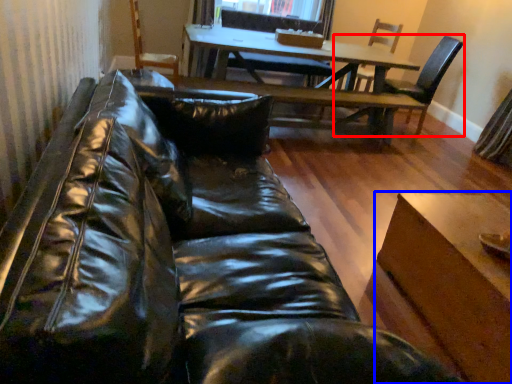
Question: Which object is closer to the camera taking this photo, chair (highlighted by a red box) or table (highlighted by a blue box)?

Choices:
 (A) chair
 (B) table

Answer: (B)